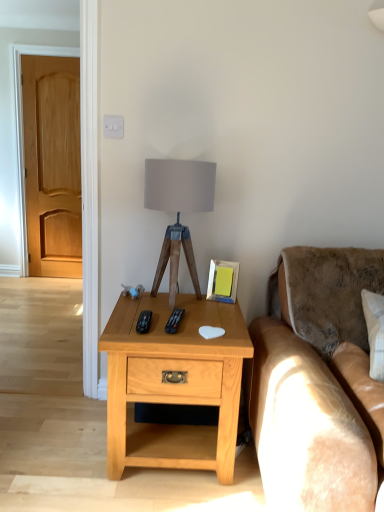
Identify the location of free point below matte gray fabric at center (from a real-world perspective). Image resolution: width=384 pixels, height=512 pixels. (186, 297).